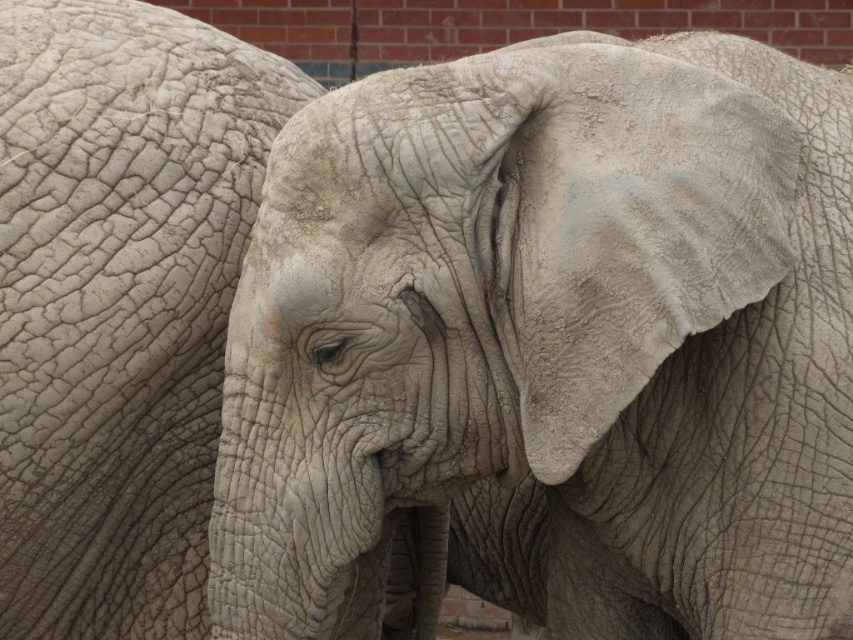
Question: Is gray textured elephant at center above gray rough skin at left?

Choices:
 (A) no
 (B) yes

Answer: (A)

Question: Among these points, which one is nearest to the camera?

Choices:
 (A) 763,420
 (B) 271,131

Answer: (A)

Question: Can you confirm if gray textured elephant at center is smaller than gray rough skin at left?

Choices:
 (A) no
 (B) yes

Answer: (A)

Question: Which object appears farthest from the camera in this image?

Choices:
 (A) gray rough skin at left
 (B) gray textured elephant at center

Answer: (A)

Question: Which point is closer to the camera?

Choices:
 (A) (15, 195)
 (B) (292, 618)

Answer: (B)

Question: Is gray textured elephant at center positioned at the back of gray rough skin at left?

Choices:
 (A) yes
 (B) no

Answer: (B)